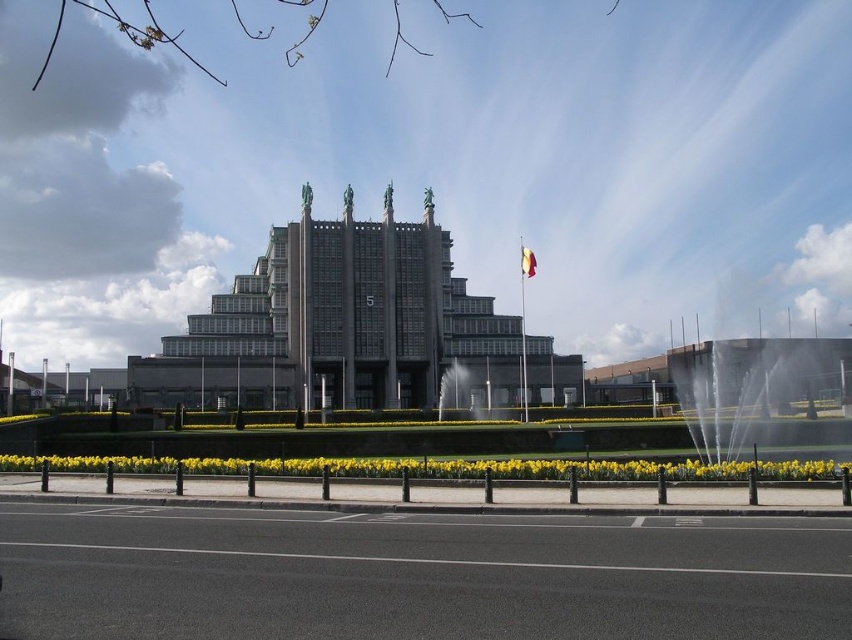
You are standing at the entrance of the building and want to find the yellow matte daffodil at lower center. Based on its coordinates, in which direction should you look to locate it?

The yellow matte daffodil at lower center is located at coordinates point [436,467], which is slightly to the right and center of the image, so you should look towards the lower center direction to find it.

You are a visitor approaching the building and see the white water at right and the yellow fabric flag at center. Which object is closer to you as you walk towards the building?

The white water at right is closer to you because it is in front of the yellow fabric flag at center.